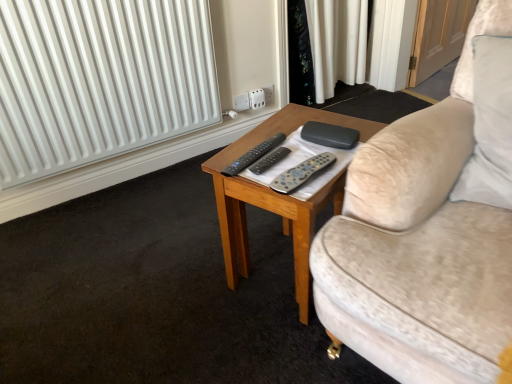
The width and height of the screenshot is (512, 384). What are the coordinates of `vacant region to the left of black matte remote control at center, which appears as the first remote control when viewed from the left` in the screenshot? It's located at click(222, 159).